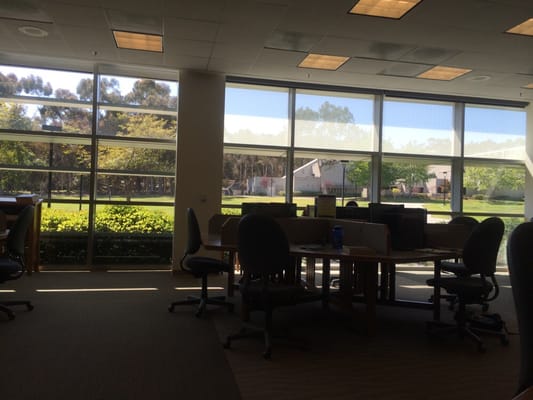
This screenshot has height=400, width=533. Identify the location of circle insets in ceiling panels. (35, 31), (479, 79).